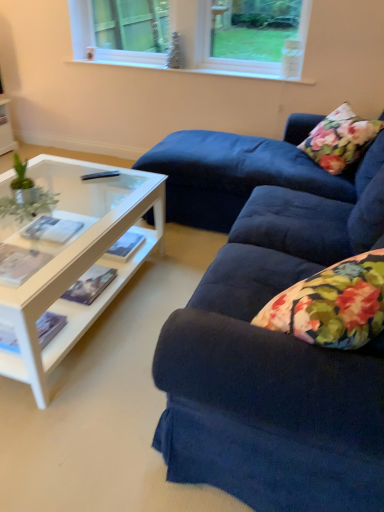
Question: From the image's perspective, would you say green leafy plant at left is positioned over white plastic window at upper center?

Choices:
 (A) yes
 (B) no

Answer: (B)

Question: Does green leafy plant at left turn towards white plastic window at upper center?

Choices:
 (A) yes
 (B) no

Answer: (B)

Question: From a real-world perspective, is green leafy plant at left beneath white plastic window at upper center?

Choices:
 (A) yes
 (B) no

Answer: (A)

Question: From a real-world perspective, does green leafy plant at left stand above white plastic window at upper center?

Choices:
 (A) yes
 (B) no

Answer: (B)

Question: Is green leafy plant at left bigger than white plastic window at upper center?

Choices:
 (A) no
 (B) yes

Answer: (A)

Question: Can you confirm if green leafy plant at left is shorter than white plastic window at upper center?

Choices:
 (A) yes
 (B) no

Answer: (A)

Question: From a real-world perspective, is floral fabric pillow at upper right located beneath black plastic remote control at center?

Choices:
 (A) no
 (B) yes

Answer: (A)

Question: Is floral fabric pillow at upper right smaller than black plastic remote control at center?

Choices:
 (A) no
 (B) yes

Answer: (A)

Question: Is floral fabric pillow at upper right far from black plastic remote control at center?

Choices:
 (A) yes
 (B) no

Answer: (A)

Question: Is floral fabric pillow at upper right to the right of black plastic remote control at center from the viewer's perspective?

Choices:
 (A) yes
 (B) no

Answer: (A)

Question: Considering the relative sizes of floral fabric pillow at upper right and black plastic remote control at center in the image provided, is floral fabric pillow at upper right shorter than black plastic remote control at center?

Choices:
 (A) no
 (B) yes

Answer: (A)

Question: From a real-world perspective, is floral fabric pillow at upper right over black plastic remote control at center?

Choices:
 (A) yes
 (B) no

Answer: (A)

Question: Does white plastic window at upper center have a lesser height compared to floral fabric pillow at upper right?

Choices:
 (A) no
 (B) yes

Answer: (B)